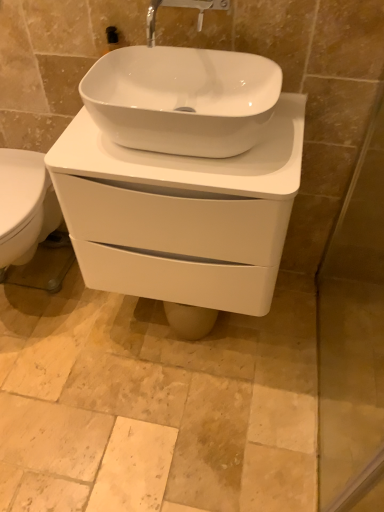
Where is `free space to the back side of transparent glass screen door at right`? The image size is (384, 512). free space to the back side of transparent glass screen door at right is located at coordinates (x=322, y=317).